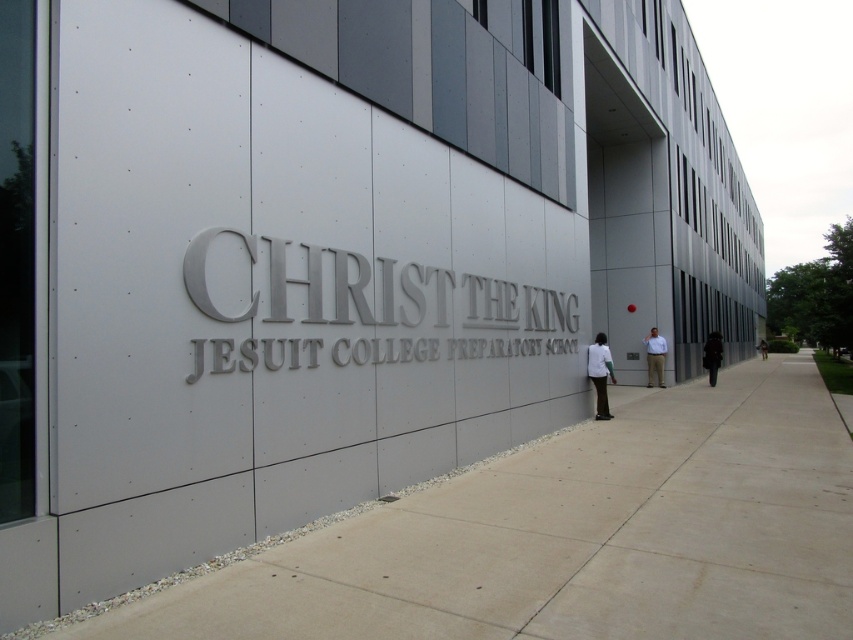
Question: Can you confirm if gray concrete pavement at center is bigger than black matte jacket at right?

Choices:
 (A) no
 (B) yes

Answer: (B)

Question: Which point is closer to the camera taking this photo?

Choices:
 (A) (648, 358)
 (B) (712, 349)
 (C) (596, 401)

Answer: (C)

Question: Is black matte jacket at right positioned before black fabric jacket at right?

Choices:
 (A) no
 (B) yes

Answer: (B)

Question: Considering the real-world distances, which object is closest to the white matte shirt at center?

Choices:
 (A) black matte jacket at right
 (B) black fabric jacket at right
 (C) gray concrete pavement at center

Answer: (C)

Question: Does light brown pants at right come in front of black fabric jacket at right?

Choices:
 (A) yes
 (B) no

Answer: (A)

Question: Which object appears farthest from the camera in this image?

Choices:
 (A) light brown pants at right
 (B) black matte jacket at right
 (C) gray concrete pavement at center

Answer: (B)